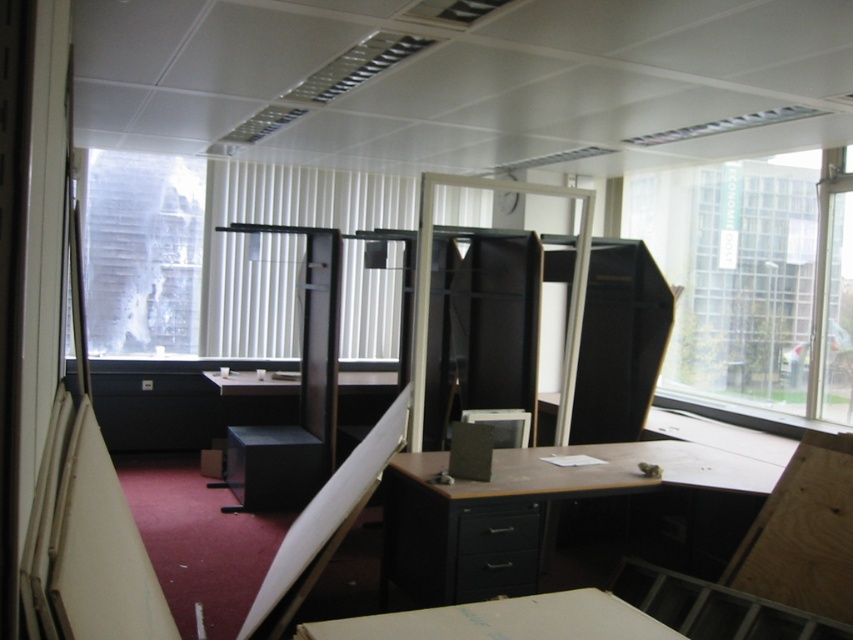
You are an office worker who needs to let in more natural light into your workspace. Given the scene, which of the transparent glass window at upper right or transparent glass window at upper left should you open or adjust to achieve this?

The transparent glass window at upper right has a larger size compared to transparent glass window at upper left, so opening or adjusting it would allow more natural light into the workspace.

You are an office worker trying to locate your desk in a disorganized office. You see the transparent glass window at upper right and the matte black desk at center. Which object is positioned more to the right side of the room?

The transparent glass window at upper right is positioned more to the right side of the room compared to the matte black desk at center.

You are an office worker who needs to move a large box from the matte black desk at center to the transparent glass window at upper left. The box is 3 meters long. Can you move it without tilting it? Please explain your reasoning based on the distance between them.

The matte black desk at center is 3.63 meters away from the transparent glass window at upper left. Since the box is 3 meters long, which is shorter than the distance between them, you can move it without tilting it.